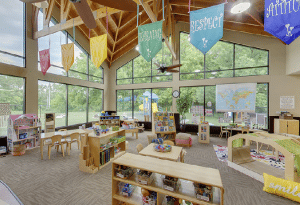
Locate an element on the screen. The width and height of the screenshot is (300, 205). ceiling fan is located at coordinates (162, 66).